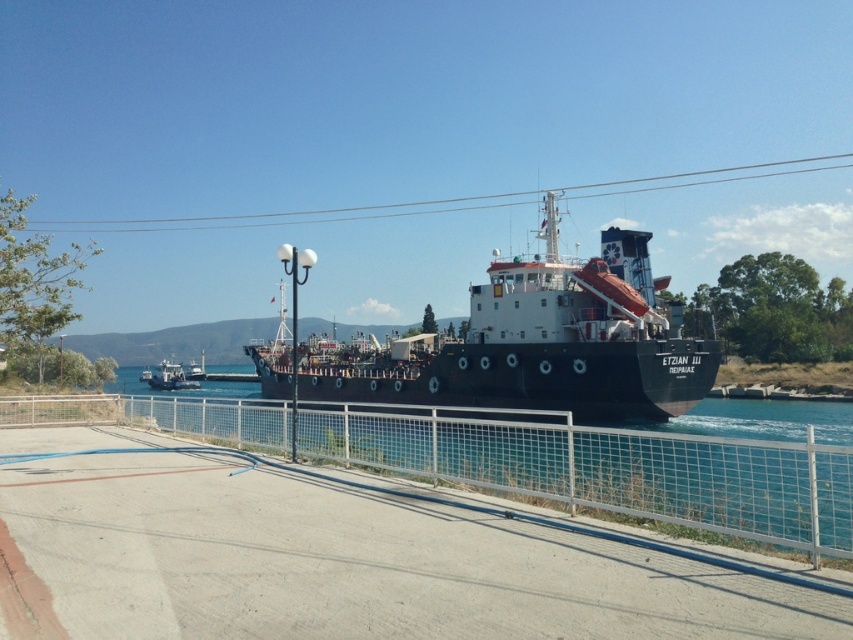
Question: Which point appears farthest from the camera in this image?

Choices:
 (A) (572, 384)
 (B) (804, 444)

Answer: (A)

Question: Can you confirm if metal mesh fence at center is smaller than metallic gray tugboat at lower left?

Choices:
 (A) yes
 (B) no

Answer: (A)

Question: Is metal mesh fence at center smaller than black matte ship at center?

Choices:
 (A) yes
 (B) no

Answer: (A)

Question: Which point is closer to the camera?

Choices:
 (A) metallic gray tugboat at lower left
 (B) metal mesh fence at center
 (C) black matte ship at center

Answer: (B)

Question: Can you confirm if black matte ship at center is positioned to the left of metallic gray tugboat at lower left?

Choices:
 (A) no
 (B) yes

Answer: (A)

Question: Which object appears farthest from the camera in this image?

Choices:
 (A) metallic gray tugboat at lower left
 (B) black matte ship at center
 (C) metal mesh fence at center

Answer: (A)